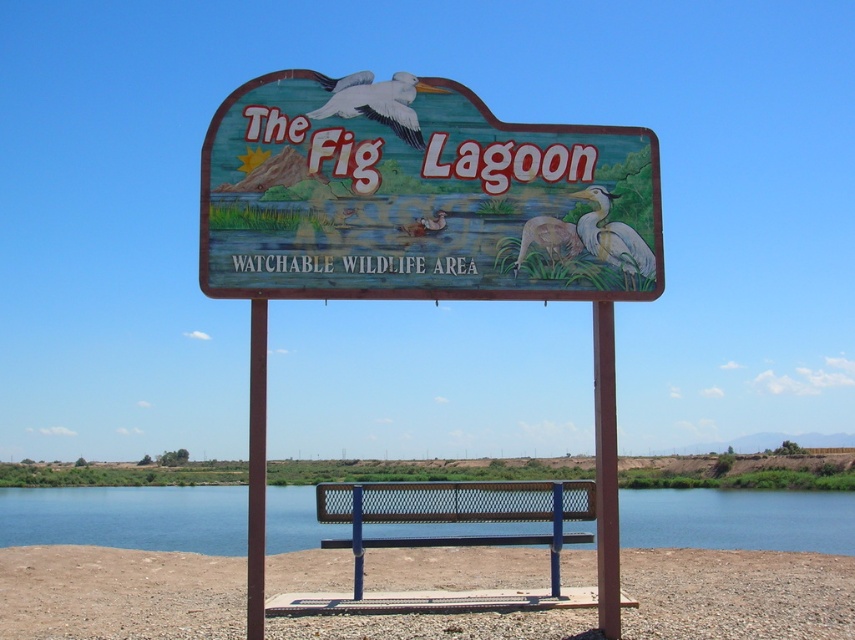
Is blue water at bench center further to camera compared to metal mesh bench at center?

Yes, blue water at bench center is further from the viewer.

What do you see at coordinates (127, 516) in the screenshot? This screenshot has width=855, height=640. I see `blue water at bench center` at bounding box center [127, 516].

Locate an element on the screen. blue water at bench center is located at coordinates (127, 516).

Who is positioned more to the right, wooden sign at center or metal mesh bench at center?

From the viewer's perspective, metal mesh bench at center appears more on the right side.

Who is higher up, wooden sign at center or metal mesh bench at center?

wooden sign at center is above.

Between point (637, 228) and point (453, 518), which one is positioned in front?

Positioned in front is point (637, 228).

This screenshot has width=855, height=640. What are the coordinates of `wooden sign at center` in the screenshot? It's located at (419, 196).

Locate an element on the screen. wooden sign at center is located at coordinates (419, 196).

Identify the location of wooden sign at center. (419, 196).